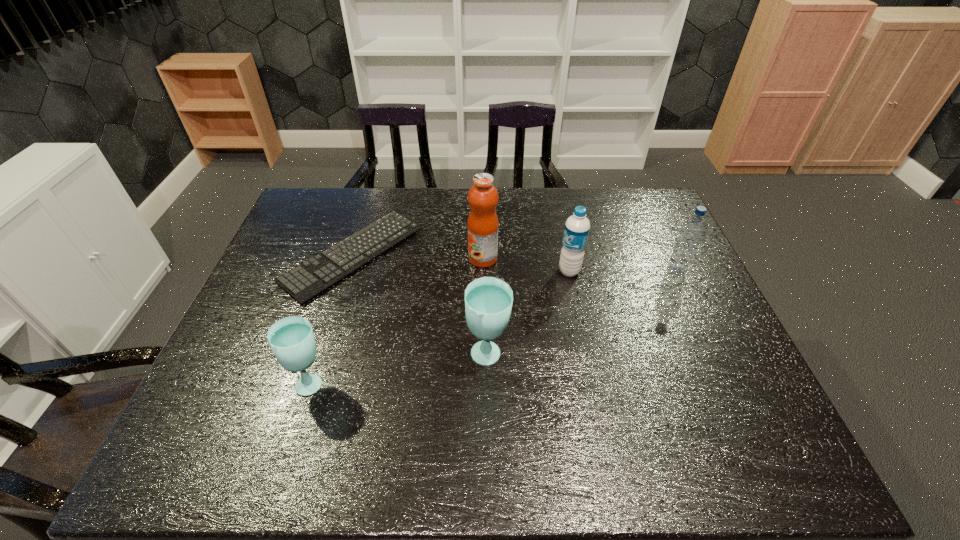
At what (x,y) coordinates should I click in order to perform the action: click on the shorter glass. Please return your answer as a coordinate pair (x, y). This screenshot has height=540, width=960. Looking at the image, I should click on (292, 340).

This screenshot has width=960, height=540. Identify the location of the fifth tallest object. (292, 340).

Identify the location of the taller glass. This screenshot has width=960, height=540. (488, 300).

Where is `the shortest object`? the shortest object is located at coordinates (303, 282).

The height and width of the screenshot is (540, 960). I want to click on the rightmost object, so click(691, 233).

The height and width of the screenshot is (540, 960). In order to click on the second object from right to left in this screenshot , I will do `click(577, 227)`.

Where is `the tallest object`? the tallest object is located at coordinates coord(482,226).

Identify the location of vacant space located 0.170m on the right of the shorter glass. Image resolution: width=960 pixels, height=540 pixels. (403, 382).

You are a GUI agent. You are given a task and a screenshot of the screen. Output one action in this format:
    pyautogui.click(x=<x>, y=<y>)
    Task: Click on the free space located on the right of the taller glass
    The image size is (960, 540).
    Given the screenshot: What is the action you would take?
    pyautogui.click(x=611, y=357)

Identify the location of blank area located on the back of the shortest object. (373, 191).